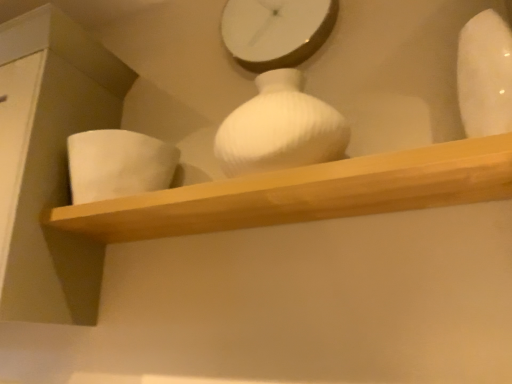
You are a GUI agent. You are given a task and a screenshot of the screen. Output one action in this format:
    pyautogui.click(x=<x>, y=<y>)
    Task: Click on the white matte vase at upper right, the 2th vase in the back-to-front sequence
    The image size is (512, 384).
    Given the screenshot: What is the action you would take?
    pyautogui.click(x=485, y=75)

In order to face white matte vase at left, acting as the 1th vase starting from the back, should I rotate leftwards or rightwards?

Rotate your view left by about 17.207°.

At what (x,y) coordinates should I click in order to perform the action: click on white glossy clock at upper center. Please return your answer as a coordinate pair (x, y). The height and width of the screenshot is (384, 512). Looking at the image, I should click on (276, 31).

This screenshot has width=512, height=384. What are the coordinates of `wooden shelf at center` in the screenshot? It's located at (306, 193).

Looking at this image, from a real-world perspective, which is physically below, white matte vase at left, the second vase in the front-to-back sequence, or white glossy clock at upper center?

In real-world perspective, white matte vase at left, the second vase in the front-to-back sequence, is lower.

Is white matte vase at left, positioned as the 2th vase in right-to-left order, at the right side of white glossy clock at upper center?

Incorrect, white matte vase at left, positioned as the 2th vase in right-to-left order, is not on the right side of white glossy clock at upper center.

Is white matte vase at left, the second vase in the front-to-back sequence, not inside white glossy clock at upper center?

white matte vase at left, the second vase in the front-to-back sequence, lies outside white glossy clock at upper center's area.

Is point (165, 152) behind point (236, 23)?

No, (165, 152) is closer to viewer.

Which is correct: white matte vase at left, acting as the 1th vase starting from the back, is inside white matte vase at upper right, which is the first vase in right-to-left order, or outside of it?

white matte vase at left, acting as the 1th vase starting from the back, is not inside white matte vase at upper right, which is the first vase in right-to-left order, it's outside.

Measure the distance between white matte vase at left, acting as the 1th vase starting from the back, and white matte vase at upper right, the 1th vase when ordered from front to back.

white matte vase at left, acting as the 1th vase starting from the back, is 84.88 centimeters away from white matte vase at upper right, the 1th vase when ordered from front to back.

Is white matte vase at left, arranged as the 1th vase when viewed from the left, aimed at white matte vase at upper right, which is the first vase in right-to-left order?

No, white matte vase at left, arranged as the 1th vase when viewed from the left, is not oriented towards white matte vase at upper right, which is the first vase in right-to-left order.

Who is more distant, white matte vase at left, arranged as the 1th vase when viewed from the left, or white matte vase at upper right, arranged as the 2th vase when viewed from the left?

white matte vase at left, arranged as the 1th vase when viewed from the left, is further from the camera.

From a real-world perspective, between white matte vase at left, the second vase in the front-to-back sequence, and wooden shelf at center, who is vertically lower?

In real-world perspective, wooden shelf at center is lower.

Does white matte vase at left, the second vase in the front-to-back sequence, have a greater height compared to wooden shelf at center?

Correct, white matte vase at left, the second vase in the front-to-back sequence, is much taller as wooden shelf at center.

Is white matte vase at left, positioned as the 2th vase in right-to-left order, located outside wooden shelf at center?

Absolutely, white matte vase at left, positioned as the 2th vase in right-to-left order, is external to wooden shelf at center.

Is white matte vase at upper right, the 2th vase in the back-to-front sequence, located outside white glossy clock at upper center?

white matte vase at upper right, the 2th vase in the back-to-front sequence, lies outside white glossy clock at upper center's area.

Which object is wider, white matte vase at upper right, which is the first vase in right-to-left order, or white glossy clock at upper center?

With larger width is white matte vase at upper right, which is the first vase in right-to-left order.

In the image, is white matte vase at upper right, arranged as the 2th vase when viewed from the left, on the left side or the right side of white glossy clock at upper center?

From the image, it's evident that white matte vase at upper right, arranged as the 2th vase when viewed from the left, is to the right of white glossy clock at upper center.

From a real-world perspective, which is physically above, white matte vase at upper right, the 2th vase in the back-to-front sequence, or white glossy clock at upper center?

white glossy clock at upper center.

Does white glossy clock at upper center have a smaller size compared to white matte vase at upper right, the 2th vase in the back-to-front sequence?

Indeed, white glossy clock at upper center has a smaller size compared to white matte vase at upper right, the 2th vase in the back-to-front sequence.

Can you confirm if white glossy clock at upper center is positioned to the right of white matte vase at upper right, arranged as the 2th vase when viewed from the left?

Incorrect, white glossy clock at upper center is not on the right side of white matte vase at upper right, arranged as the 2th vase when viewed from the left.

Where is `clock that is on the left side of white matte vase at upper right, which is the first vase in right-to-left order`? The height and width of the screenshot is (384, 512). clock that is on the left side of white matte vase at upper right, which is the first vase in right-to-left order is located at coordinates (276, 31).

Is white glossy clock at upper center oriented away from white matte vase at upper right, which is the first vase in right-to-left order?

No, white glossy clock at upper center is not facing away from white matte vase at upper right, which is the first vase in right-to-left order.

In terms of width, does wooden shelf at center look wider or thinner when compared to white matte vase at upper right, which is the first vase in right-to-left order?

Considering their sizes, wooden shelf at center looks broader than white matte vase at upper right, which is the first vase in right-to-left order.

Considering the relative sizes of wooden shelf at center and white matte vase at upper right, arranged as the 2th vase when viewed from the left, in the image provided, is wooden shelf at center taller than white matte vase at upper right, arranged as the 2th vase when viewed from the left,?

Incorrect, the height of wooden shelf at center is not larger of that of white matte vase at upper right, arranged as the 2th vase when viewed from the left.

Is wooden shelf at center directly adjacent to white matte vase at upper right, the 2th vase in the back-to-front sequence?

No, wooden shelf at center is not touching white matte vase at upper right, the 2th vase in the back-to-front sequence.

You are a GUI agent. You are given a task and a screenshot of the screen. Output one action in this format:
    pyautogui.click(x=<x>, y=<y>)
    Task: Click on the shelf located on the left of white matte vase at upper right, the 2th vase in the back-to-front sequence
    The image size is (512, 384).
    Given the screenshot: What is the action you would take?
    pyautogui.click(x=306, y=193)

Based on the photo, is white glossy clock at upper center far away from wooden shelf at center?

white glossy clock at upper center is near wooden shelf at center, not far away.

Which is correct: white glossy clock at upper center is inside wooden shelf at center, or outside of it?

white glossy clock at upper center is not enclosed by wooden shelf at center.

Which object is closer to the camera taking this photo, white glossy clock at upper center or wooden shelf at center?

Positioned in front is wooden shelf at center.

What are the coordinates of `clock positioned vertically above the white matte vase at left, the second vase in the front-to-back sequence (from a real-world perspective)` in the screenshot? It's located at (276, 31).

Where is `vase in front of the white matte vase at left, positioned as the 2th vase in right-to-left order`? Image resolution: width=512 pixels, height=384 pixels. vase in front of the white matte vase at left, positioned as the 2th vase in right-to-left order is located at coordinates (485, 75).

Estimate the real-world distances between objects in this image. Which object is closer to white glossy clock at upper center, wooden shelf at center or white matte vase at upper right, arranged as the 2th vase when viewed from the left?

white matte vase at upper right, arranged as the 2th vase when viewed from the left, is closer to white glossy clock at upper center.

Based on the photo, when comparing their distances from wooden shelf at center, does white matte vase at upper right, arranged as the 2th vase when viewed from the left, or white matte vase at left, acting as the 1th vase starting from the back, seem further?

white matte vase at upper right, arranged as the 2th vase when viewed from the left, lies further to wooden shelf at center than the other object.

Which object lies further to the anchor point white matte vase at left, acting as the 1th vase starting from the back, white matte vase at upper right, the 1th vase when ordered from front to back, or wooden shelf at center?

white matte vase at upper right, the 1th vase when ordered from front to back.

Based on their spatial positions, is wooden shelf at center or white matte vase at upper right, the 2th vase in the back-to-front sequence, closer to white matte vase at left, the second vase in the front-to-back sequence?

Based on the image, wooden shelf at center appears to be nearer to white matte vase at left, the second vase in the front-to-back sequence.

Which object lies further to the anchor point wooden shelf at center, white matte vase at left, acting as the 1th vase starting from the back, or white glossy clock at upper center?

white glossy clock at upper center is positioned further to the anchor wooden shelf at center.

Estimate the real-world distances between objects in this image. Which object is further from white matte vase at upper right, the 1th vase when ordered from front to back, white glossy clock at upper center or wooden shelf at center?

white glossy clock at upper center is positioned further to the anchor white matte vase at upper right, the 1th vase when ordered from front to back.

From the image, which object appears to be nearer to white glossy clock at upper center, white matte vase at upper right, which is the first vase in right-to-left order, or white matte vase at left, positioned as the 2th vase in right-to-left order?

Based on the image, white matte vase at left, positioned as the 2th vase in right-to-left order, appears to be nearer to white glossy clock at upper center.

Which object lies further to the anchor point wooden shelf at center, white matte vase at left, arranged as the 1th vase when viewed from the left, or white matte vase at upper right, the 1th vase when ordered from front to back?

white matte vase at upper right, the 1th vase when ordered from front to back, lies further to wooden shelf at center than the other object.

Locate an element on the screen. The image size is (512, 384). clock between white matte vase at left, the second vase in the front-to-back sequence, and white matte vase at upper right, which is the first vase in right-to-left order is located at coordinates (276, 31).

This screenshot has width=512, height=384. Find the location of `shelf between white matte vase at left, arranged as the 1th vase when viewed from the left, and white matte vase at upper right, arranged as the 2th vase when viewed from the left, from left to right`. shelf between white matte vase at left, arranged as the 1th vase when viewed from the left, and white matte vase at upper right, arranged as the 2th vase when viewed from the left, from left to right is located at coordinates tap(306, 193).